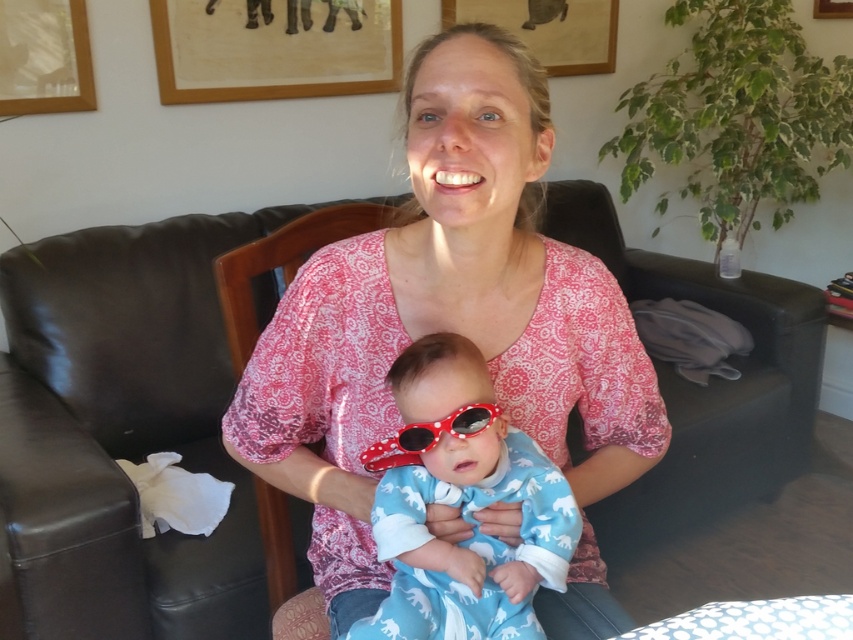
Is pink printed blouse at center to the left of polka dot plastic goggles at center from the viewer's perspective?

Incorrect, pink printed blouse at center is not on the left side of polka dot plastic goggles at center.

Is point (329, 568) positioned behind point (404, 456)?

Yes.

Locate an element on the screen. The image size is (853, 640). pink printed blouse at center is located at coordinates (445, 316).

Find the location of a particular element. Image resolution: width=853 pixels, height=640 pixels. pink printed blouse at center is located at coordinates (445, 316).

You are a GUI agent. You are given a task and a screenshot of the screen. Output one action in this format:
    pyautogui.click(x=<x>, y=<y>)
    Task: Click on the pink printed blouse at center
    The image size is (853, 640).
    Given the screenshot: What is the action you would take?
    (445, 316)

Is pink printed blouse at center bigger than blue cotton onesie at center?

Yes.

Where is `pink printed blouse at center`? This screenshot has height=640, width=853. pink printed blouse at center is located at coordinates (445, 316).

You are a GUI agent. You are given a task and a screenshot of the screen. Output one action in this format:
    pyautogui.click(x=<x>, y=<y>)
    Task: Click on the pink printed blouse at center
    This screenshot has width=853, height=640.
    Given the screenshot: What is the action you would take?
    pyautogui.click(x=445, y=316)

Locate an element on the screen. black leather couch at center is located at coordinates (125, 429).

Is black leather couch at center bigger than polka dot plastic goggles at center?

Yes.

Where is `black leather couch at center`? black leather couch at center is located at coordinates (125, 429).